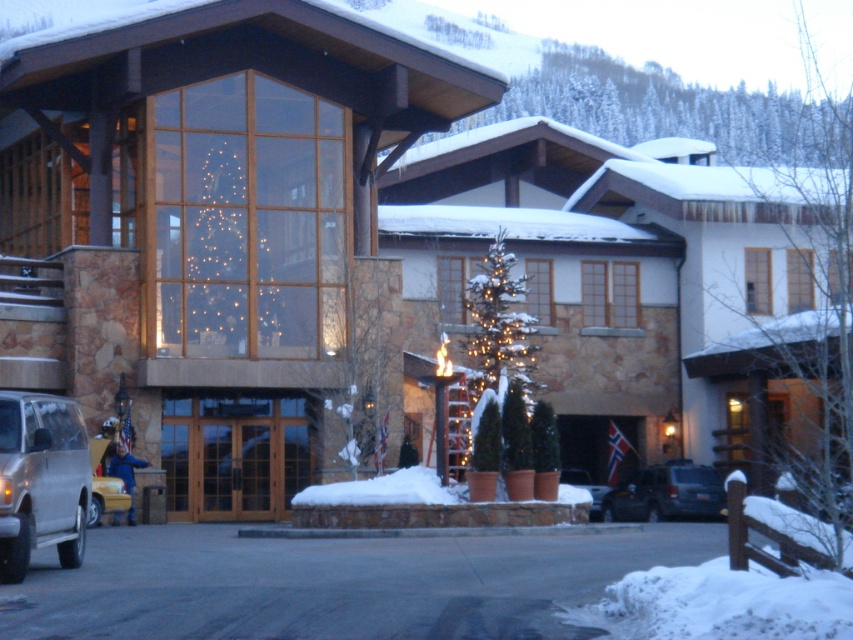
You are a guest arriving at the ski resort and need to park your car. The resort requires that vehicles must be parked in a space that can accommodate their size. Given that the dark gray suv at center and the yellow matte taxi at lower left are both parked in the same parking area, which vehicle would require a larger parking space?

The dark gray suv at center requires a larger parking space because it is larger in size than the yellow matte taxi at lower left.

You are a guest arriving at the ski resort and see the gold metallic suv at lower left and the yellow matte taxi at lower left. Which vehicle is closer to the entrance of the building?

The gold metallic suv at lower left is closer to the entrance of the building because it is in front of the yellow matte taxi at lower left, which is further away.